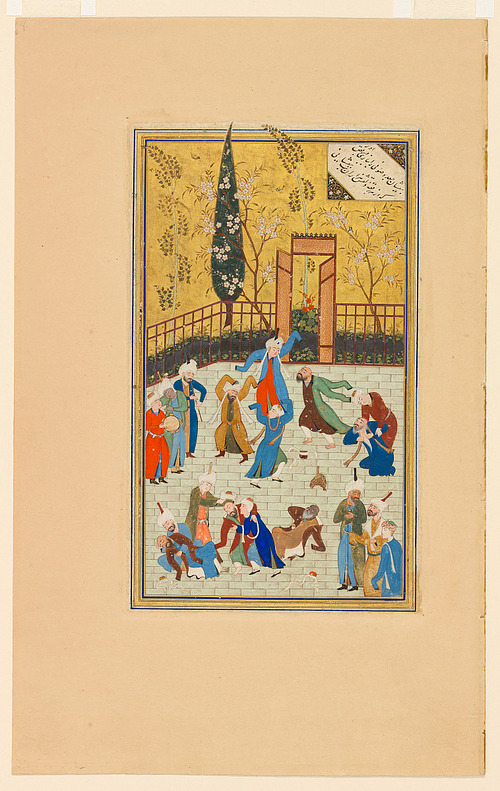
Locate an element on the screen. The width and height of the screenshot is (500, 791). gold fram is located at coordinates (407, 477).